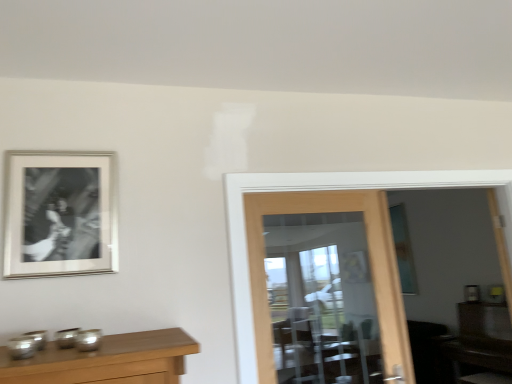
Locate an element on the screen. The image size is (512, 384). empty space that is ontop of clear glass door at center (from a real-world perspective) is located at coordinates (309, 192).